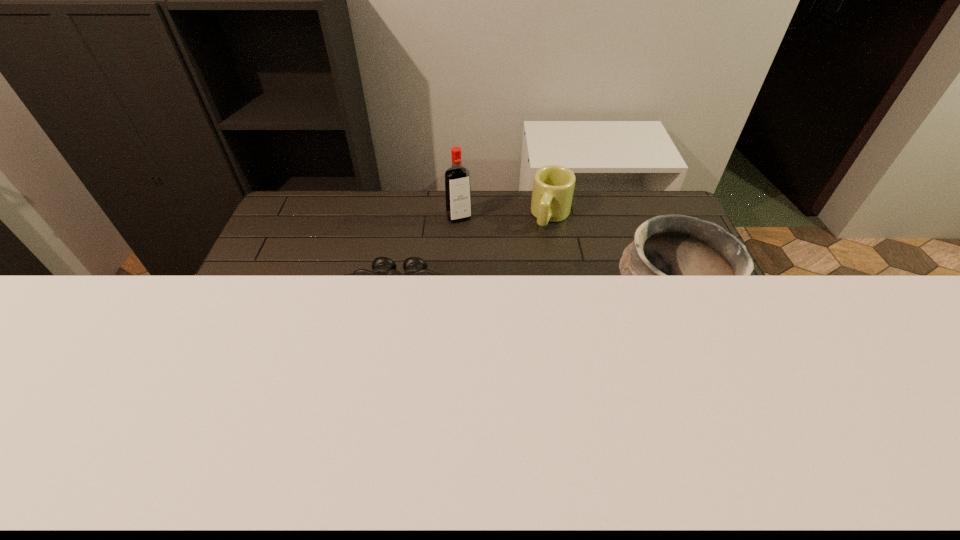
This screenshot has height=540, width=960. What are the coordinates of `vacant area at the near left corner of the desktop` in the screenshot? It's located at (193, 413).

Where is `unoccupied position between the pottery and the vodka`? unoccupied position between the pottery and the vodka is located at coordinates (562, 263).

At what (x,y) coordinates should I click in order to perform the action: click on vacant region between the mug and the vodka. Please return your answer as a coordinate pair (x, y). The width and height of the screenshot is (960, 540). Looking at the image, I should click on (505, 217).

Image resolution: width=960 pixels, height=540 pixels. What are the coordinates of `unoccupied area between the mug and the binoculars` in the screenshot? It's located at (474, 261).

I want to click on vacant area between the vodka and the second object from right to left, so click(x=505, y=217).

Locate an element on the screen. Image resolution: width=960 pixels, height=540 pixels. free point between the second object from right to left and the binoculars is located at coordinates (474, 261).

This screenshot has width=960, height=540. In order to click on free space between the mug and the binoculars in this screenshot , I will do `click(474, 261)`.

Identify the location of unoccupied position between the rightmost object and the vodka. (562, 263).

Where is `vacant space that's between the mug and the vodka`? The width and height of the screenshot is (960, 540). vacant space that's between the mug and the vodka is located at coordinates (505, 217).

Find the location of a particular element. Image resolution: width=960 pixels, height=540 pixels. empty location between the binoculars and the vodka is located at coordinates (428, 263).